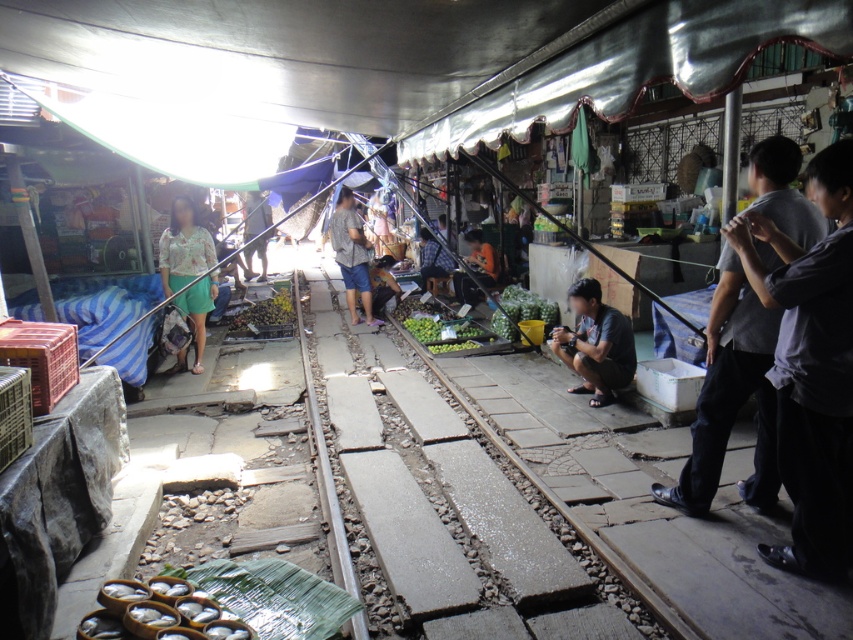
Is dark gray shirt at center below matte gray shirt at center?

Indeed, dark gray shirt at center is positioned under matte gray shirt at center.

Is point (622, 330) farther from camera compared to point (346, 285)?

No, it is not.

Locate an element on the screen. This screenshot has width=853, height=640. dark gray shirt at center is located at coordinates (595, 342).

Is floral fabric shirt at center positioned before matte gray shirt at center?

Yes.

Looking at this image, can you confirm if floral fabric shirt at center is smaller than matte gray shirt at center?

No.

Between point (202, 264) and point (357, 221), which one is positioned behind?

The point (357, 221) is behind.

Where is `floral fabric shirt at center`? floral fabric shirt at center is located at coordinates (189, 269).

Does dark gray shirt at right appear over dark gray shirt at center?

No, dark gray shirt at right is not above dark gray shirt at center.

Which is in front, point (778, 209) or point (581, 323)?

Point (778, 209)

This screenshot has width=853, height=640. In order to click on dark gray shirt at right in this screenshot , I will do `click(730, 396)`.